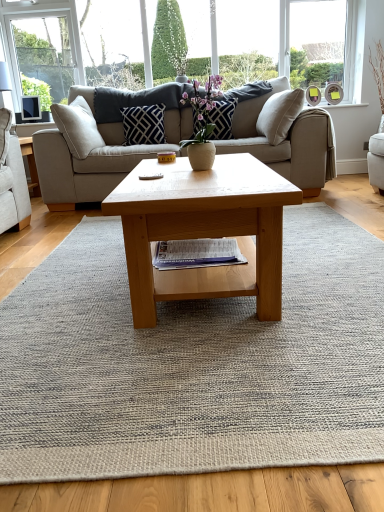
The height and width of the screenshot is (512, 384). In order to click on vacant area that is situated to the right of light brown wooden coffee table at center in this screenshot , I will do point(333,264).